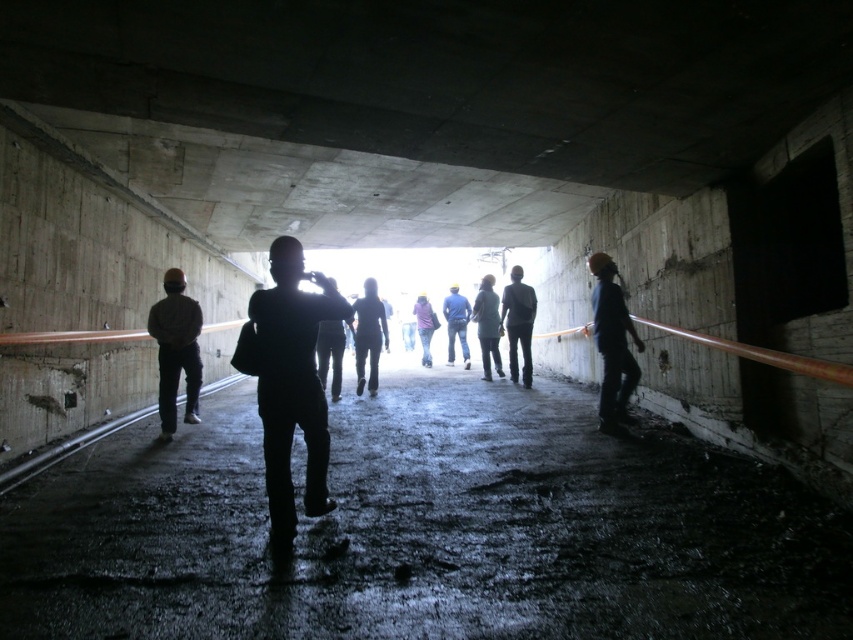
Question: Estimate the real-world distances between objects in this image. Which object is closer to the purple fabric jacket at center?

Choices:
 (A) silhouette jacket at center
 (B) dark gray fabric jacket at left
 (C) blue fabric jacket at center
 (D) dark blue jeans at center

Answer: (C)

Question: Which object appears closest to the camera in this image?

Choices:
 (A) dark blue fabric jacket at center
 (B) purple fabric jacket at center
 (C) silhouette jacket at center
 (D) blue fabric jacket at center

Answer: (C)

Question: Does hard hat at right come in front of purple fabric jacket at center?

Choices:
 (A) no
 (B) yes

Answer: (B)

Question: Which point is farther to the camera?

Choices:
 (A) dark matte clothing at center
 (B) dark blue jeans at center
 (C) purple fabric jacket at center

Answer: (C)

Question: Considering the relative positions of silhouette fabric at center and dark blue jeans at center in the image provided, where is silhouette fabric at center located with respect to dark blue jeans at center?

Choices:
 (A) right
 (B) left

Answer: (B)

Question: Is hard hat at right below silhouette jacket at center?

Choices:
 (A) yes
 (B) no

Answer: (B)